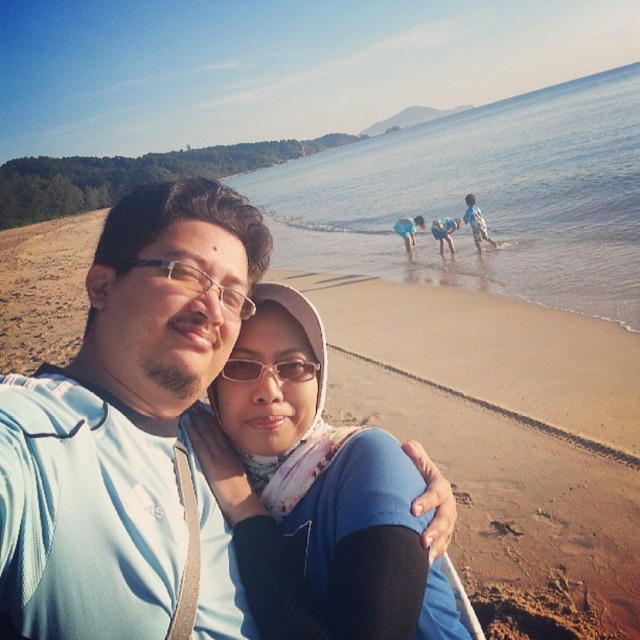
Does blue water at center have a smaller size compared to transparent plastic glasses at center?

No.

Locate an element on the screen. Image resolution: width=640 pixels, height=640 pixels. blue water at center is located at coordinates (481, 198).

Which is in front, point (467, 152) or point (250, 364)?

Point (250, 364)

You are a GUI agent. You are given a task and a screenshot of the screen. Output one action in this format:
    pyautogui.click(x=<x>, y=<y>)
    Task: Click on the blue water at center
    
    Given the screenshot: What is the action you would take?
    pyautogui.click(x=481, y=198)

Can you confirm if matte blue scarf at center is taller than matte black glasses at center?

Indeed, matte blue scarf at center has a greater height compared to matte black glasses at center.

Which of these two, matte blue scarf at center or matte black glasses at center, stands shorter?

matte black glasses at center

Does point (257, 426) lie behind point (189, 268)?

Yes, it is.

Find the location of `matte blue scarf at center`. matte blue scarf at center is located at coordinates (317, 499).

The height and width of the screenshot is (640, 640). I want to click on matte blue shirt at center, so click(122, 417).

Is point (83, 416) positioned in front of point (284, 362)?

Yes.

Which is behind, point (125, 396) or point (292, 368)?

The point (292, 368) is behind.

At what (x,y) coordinates should I click in order to perform the action: click on matte blue shirt at center. Please return your answer as a coordinate pair (x, y). The height and width of the screenshot is (640, 640). Looking at the image, I should click on (122, 417).